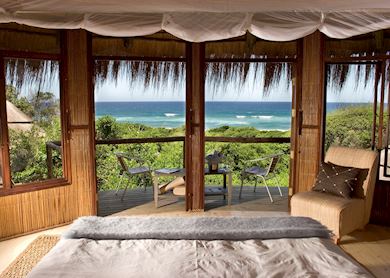
Locate an element on the screen. The width and height of the screenshot is (390, 278). pillow is located at coordinates (332, 177).